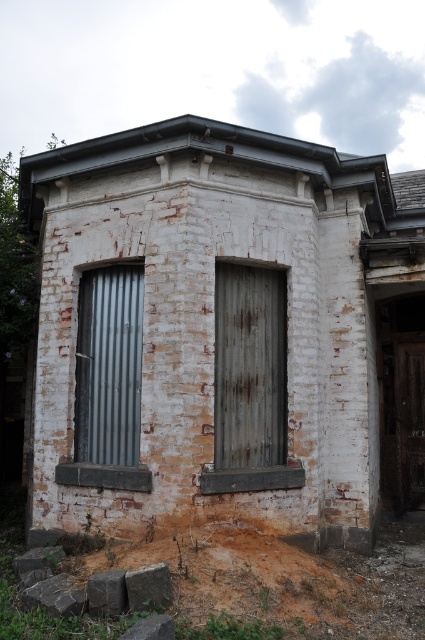
Does rusty metal door at center have a greater height compared to brown wooden door at right?

No.

In order to click on rusty metal door at center in this screenshot , I will do `click(249, 365)`.

Is rusty metal door at center further to the viewer compared to metallic corrugated door at left?

No, rusty metal door at center is closer to the viewer.

Consider the image. Who is more forward, (280, 307) or (87, 305)?

Point (280, 307) is in front.

At what (x,y) coordinates should I click in order to perform the action: click on rusty metal door at center. Please return your answer as a coordinate pair (x, y). This screenshot has width=425, height=640. Looking at the image, I should click on (249, 365).

Does metallic corrugated door at left come behind brown wooden door at right?

No, it is in front of brown wooden door at right.

Is point (82, 400) positioned before point (399, 401)?

Yes, point (82, 400) is closer to viewer.

You are a GUI agent. You are given a task and a screenshot of the screen. Output one action in this format:
    pyautogui.click(x=<x>, y=<y>)
    Task: Click on the metallic corrugated door at left
    The height and width of the screenshot is (640, 425).
    Given the screenshot: What is the action you would take?
    pyautogui.click(x=108, y=365)